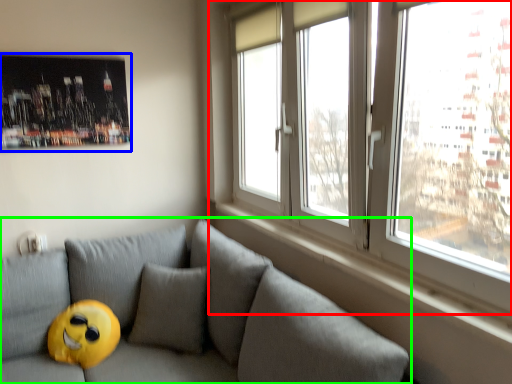
Question: Which object is positioned farthest from window (highlighted by a red box)? Select from picture frame (highlighted by a blue box) and studio couch (highlighted by a green box).

Choices:
 (A) picture frame
 (B) studio couch

Answer: (A)